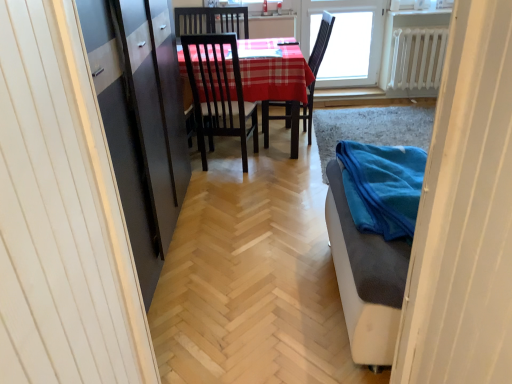
Where is `vacant space that is to the left of blue fabric at lower right`? vacant space that is to the left of blue fabric at lower right is located at coordinates (253, 294).